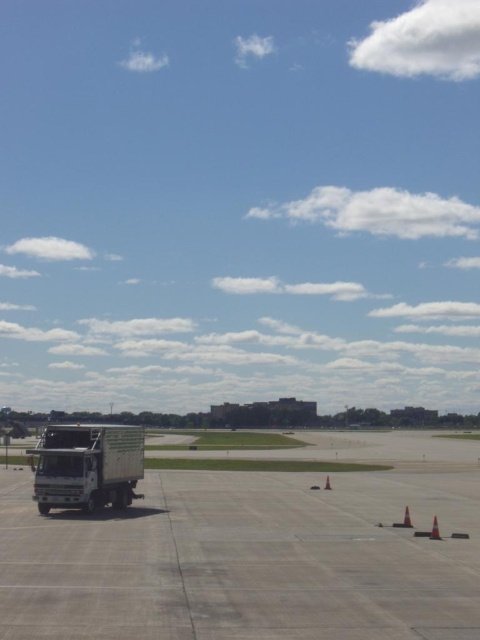
You are a pilot preparing to taxi your plane and need to know if there is enough space between the gray concrete tarmac at lower left and the white glossy truck at lower left for your plane to pass. Can you determine if the space is sufficient?

The gray concrete tarmac at lower left is larger in size than the white glossy truck at lower left, so there is likely enough space for the plane to pass between them.

You are a maintenance worker who needs to place a new orange cone between the two orange cones on the tarmac. The new cone has a diameter of 0.5 meters. Can the new cone fit between the existing orange reflective cone at lower right and orange cone at lower right without overlapping them?

The distance between the orange reflective cone at lower right and orange cone at lower right is 1.22 meters. The new cone has a diameter of 0.5 meters, so there is enough space between them to place the new cone without overlapping since 1.22 meters is greater than 0.5 meters.